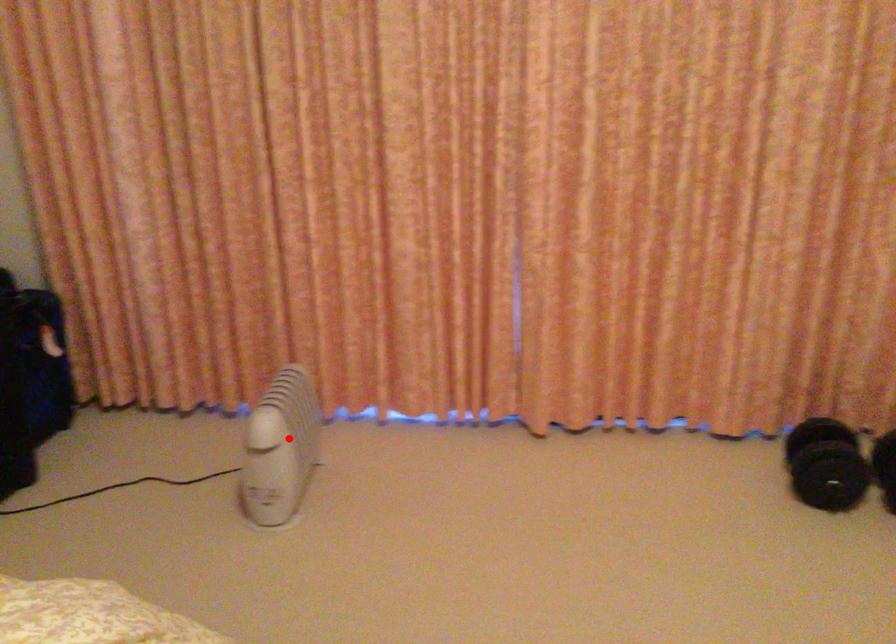
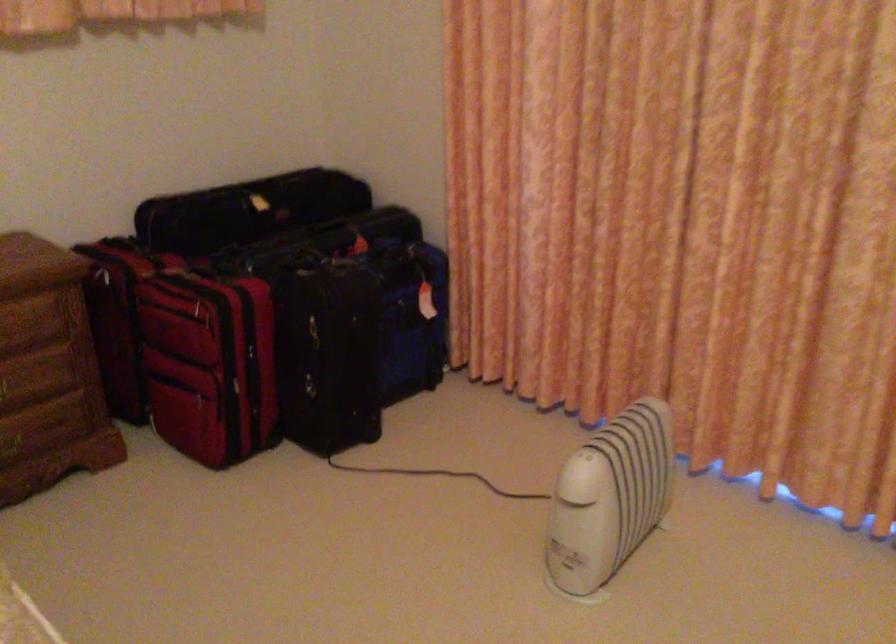
Find the pixel in the second image that matches the highlighted location in the first image.

(609, 498)